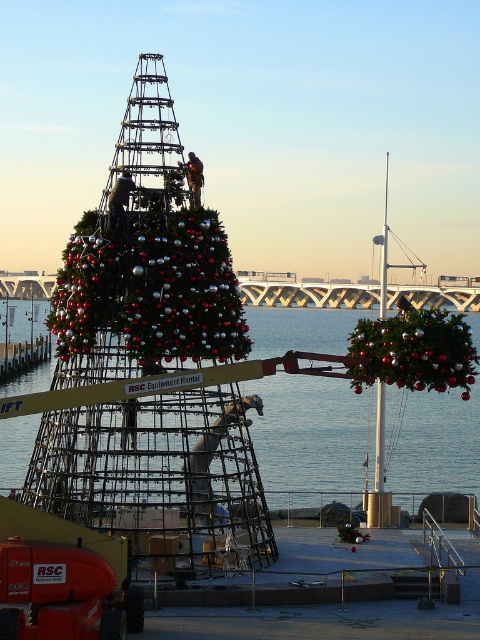
Who is more distant from viewer, [405,483] or [432,312]?

Point [405,483]

Which is below, clear blue water at center or shiny metallic garland at right?

clear blue water at center is below.

Who is more forward, (302, 412) or (406, 340)?

Positioned in front is point (406, 340).

I want to click on clear blue water at center, so 312,433.

Does clear blue water at center appear under shiny metallic christmas tree at left?

Indeed, clear blue water at center is positioned under shiny metallic christmas tree at left.

Can you confirm if clear blue water at center is smaller than shiny metallic christmas tree at left?

No.

Which is behind, point (404, 413) or point (67, 273)?

The point (404, 413) is behind.

You are a GUI agent. You are given a task and a screenshot of the screen. Output one action in this format:
    pyautogui.click(x=<x>, y=<y>)
    Task: Click on the clear blue water at center
    The height and width of the screenshot is (640, 480).
    Given the screenshot: What is the action you would take?
    pyautogui.click(x=312, y=433)

Between shiny metallic garland at right and shiny metallic christmas tree at left, which one appears on the left side from the viewer's perspective?

shiny metallic christmas tree at left is more to the left.

Is point (439, 330) farther from viewer compared to point (100, 241)?

No, it is in front of (100, 241).

Locate an element on the screen. This screenshot has width=480, height=640. shiny metallic garland at right is located at coordinates (415, 349).